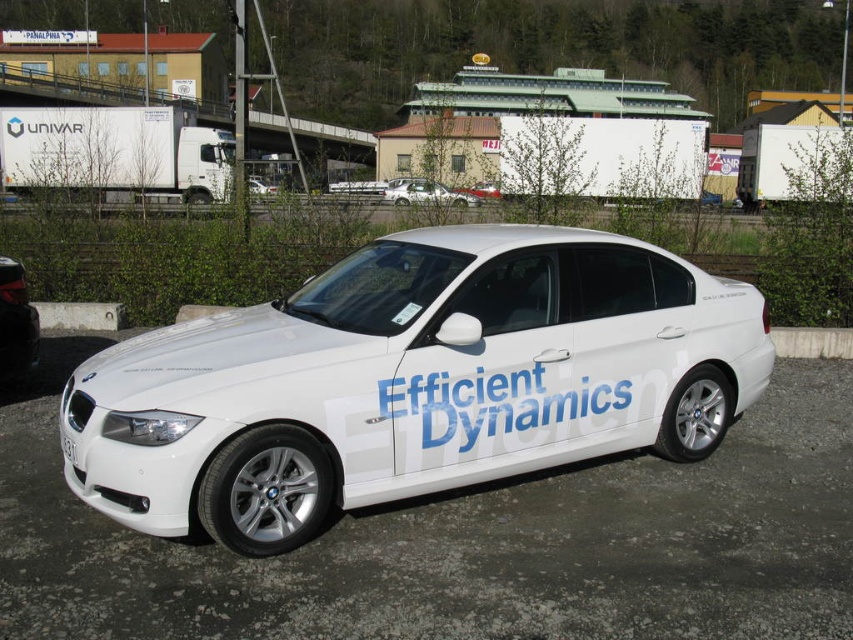
Between white metallic car at center and silver metallic sedan at center, which one has more height?

white metallic car at center

Who is more distant from viewer, (236, 416) or (396, 202)?

Point (396, 202)

I want to click on white metallic car at center, so click(413, 380).

Which is more to the left, white glossy car at lower left or gray concrete curb at lower left?

gray concrete curb at lower left is more to the left.

Is white glossy car at lower left smaller than gray concrete curb at lower left?

Indeed, white glossy car at lower left has a smaller size compared to gray concrete curb at lower left.

Find the location of a particular element. Image resolution: width=853 pixels, height=640 pixels. white glossy car at lower left is located at coordinates (15, 321).

Where is `white glossy car at lower left`? white glossy car at lower left is located at coordinates (15, 321).

Between gray concrete curb at lower left and silver metallic sedan at center, which one is positioned lower?

gray concrete curb at lower left

Does gray concrete curb at lower left come in front of silver metallic sedan at center?

That is True.

The width and height of the screenshot is (853, 640). I want to click on gray concrete curb at lower left, so click(x=80, y=316).

Identify the location of gray concrete curb at lower left. (80, 316).